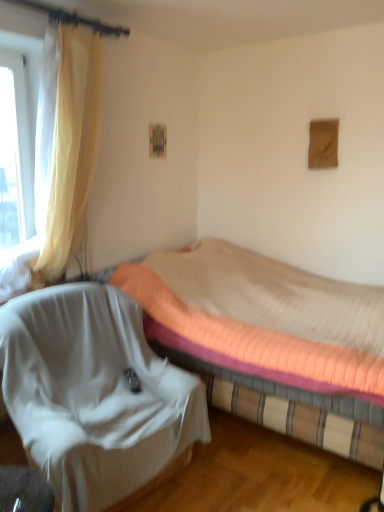
Question: Is transparent glass window at left far away from yellow sheer curtain at left?

Choices:
 (A) no
 (B) yes

Answer: (A)

Question: From the image's perspective, would you say transparent glass window at left is shown under yellow sheer curtain at left?

Choices:
 (A) no
 (B) yes

Answer: (A)

Question: Does transparent glass window at left come behind yellow sheer curtain at left?

Choices:
 (A) yes
 (B) no

Answer: (A)

Question: Is transparent glass window at left not inside yellow sheer curtain at left?

Choices:
 (A) yes
 (B) no

Answer: (A)

Question: Is transparent glass window at left at the right side of yellow sheer curtain at left?

Choices:
 (A) yes
 (B) no

Answer: (B)

Question: Is transparent glass window at left situated inside white fabric chair at lower left or outside?

Choices:
 (A) inside
 (B) outside

Answer: (B)

Question: Does point (13, 92) appear closer or farther from the camera than point (162, 442)?

Choices:
 (A) farther
 (B) closer

Answer: (A)

Question: From a real-world perspective, is transparent glass window at left physically located above or below white fabric chair at lower left?

Choices:
 (A) below
 (B) above

Answer: (B)

Question: Is transparent glass window at left taller or shorter than white fabric chair at lower left?

Choices:
 (A) tall
 (B) short

Answer: (A)

Question: From the image's perspective, is pink quilted mattress at center located above or below white fabric chair at lower left?

Choices:
 (A) below
 (B) above

Answer: (B)

Question: From a real-world perspective, is pink quilted mattress at center above or below white fabric chair at lower left?

Choices:
 (A) below
 (B) above

Answer: (B)

Question: Considering the positions of pink quilted mattress at center and white fabric chair at lower left in the image, is pink quilted mattress at center wider or thinner than white fabric chair at lower left?

Choices:
 (A) thin
 (B) wide

Answer: (B)

Question: Is pink quilted mattress at center taller or shorter than white fabric chair at lower left?

Choices:
 (A) short
 (B) tall

Answer: (B)

Question: From a real-world perspective, relative to transparent glass window at left, is pink quilted mattress at center vertically above or below?

Choices:
 (A) below
 (B) above

Answer: (A)

Question: From their relative heights in the image, would you say pink quilted mattress at center is taller or shorter than transparent glass window at left?

Choices:
 (A) tall
 (B) short

Answer: (B)